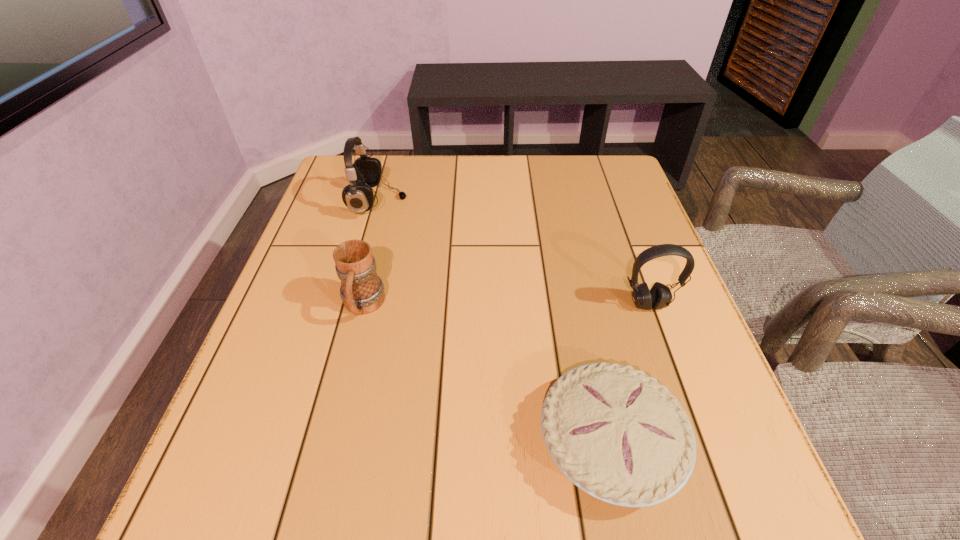
Identify the location of object positioned at the far edge. (365, 173).

Locate an element on the screen. The width and height of the screenshot is (960, 540). object located at the near edge is located at coordinates (616, 433).

I want to click on headset that is at the left edge, so click(365, 173).

The height and width of the screenshot is (540, 960). I want to click on mug that is at the left edge, so click(362, 291).

In order to click on headset present at the right edge in this screenshot , I will do `click(659, 296)`.

You are a GUI agent. You are given a task and a screenshot of the screen. Output one action in this format:
    pyautogui.click(x=<x>, y=<y>)
    Task: Click on the pie at the right edge
    This screenshot has width=960, height=540.
    Given the screenshot: What is the action you would take?
    pyautogui.click(x=616, y=433)

The width and height of the screenshot is (960, 540). Find the location of `object that is at the far left corner`. object that is at the far left corner is located at coordinates (365, 173).

Where is `object present at the near right corner`? The width and height of the screenshot is (960, 540). object present at the near right corner is located at coordinates (616, 433).

Identify the location of vacant space at the far edge of the desktop. (387, 191).

This screenshot has width=960, height=540. Find the location of `vacant space at the left edge of the desktop`. vacant space at the left edge of the desktop is located at coordinates (252, 393).